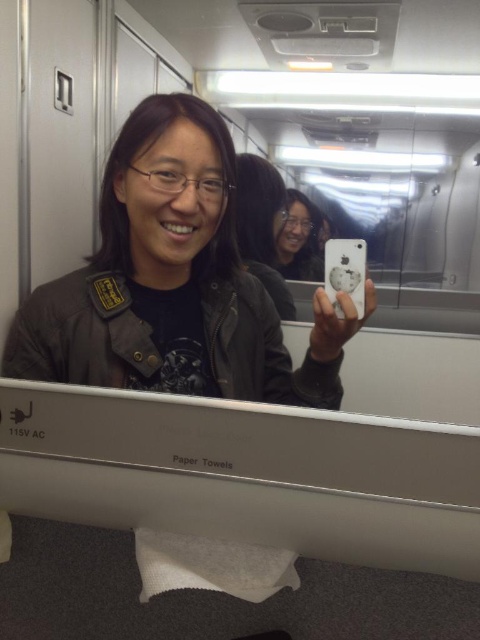
Does matte black jacket at center appear under matte black phone at center?

Yes.

From the picture: Is matte black jacket at center smaller than matte black phone at center?

No, matte black jacket at center is not smaller than matte black phone at center.

Does point (218, 308) come farther from viewer compared to point (286, 260)?

Yes, point (218, 308) is farther from viewer.

Identify the location of matte black jacket at center. The image size is (480, 640). (172, 282).